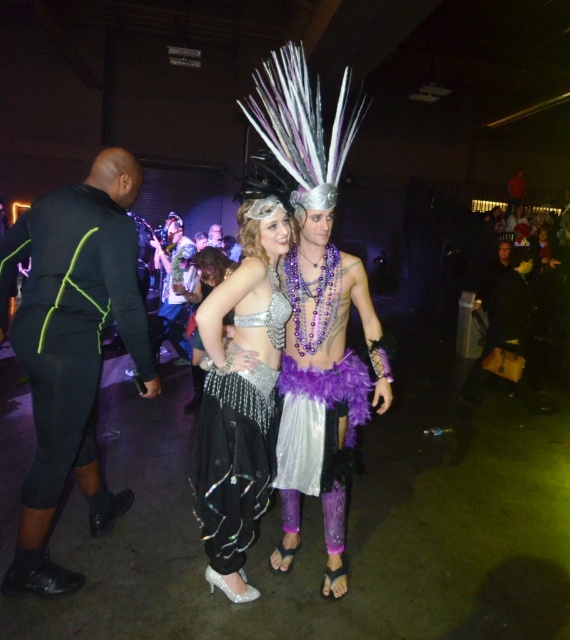
Which is in front, point (491, 289) or point (213, 230)?

Positioned in front is point (491, 289).

Where is `black leather jacket at center`? black leather jacket at center is located at coordinates (503, 320).

Who is shorter, black leather jacket at center or shiny metallic vest at center?

With less height is black leather jacket at center.

Does black leather jacket at center appear under shiny metallic vest at center?

Yes, black leather jacket at center is below shiny metallic vest at center.

Is point (482, 378) behind point (169, 296)?

No, (482, 378) is in front of (169, 296).

Locate an element on the screen. This screenshot has height=640, width=570. black leather jacket at center is located at coordinates (503, 320).

In the scene shown: Can you confirm if sparkly silver dress at center is positioned to the left of shiny silver headdress at center?

In fact, sparkly silver dress at center is to the right of shiny silver headdress at center.

Is sparkly silver dress at center positioned behind shiny silver headdress at center?

No, sparkly silver dress at center is in front of shiny silver headdress at center.

Locate an element on the screen. This screenshot has height=640, width=570. sparkly silver dress at center is located at coordinates (206, 273).